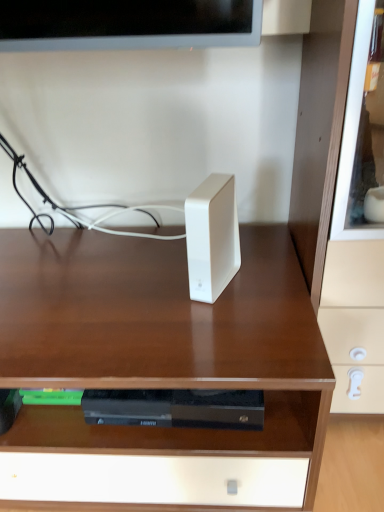
Question: Choose the correct answer: Is white matte ipod at center inside matte white drawer at right or outside it?

Choices:
 (A) inside
 (B) outside

Answer: (B)

Question: Looking at their shapes, would you say white matte ipod at center is wider or thinner than matte white drawer at right?

Choices:
 (A) wide
 (B) thin

Answer: (B)

Question: Which is farther from the matte white drawer at right?

Choices:
 (A) white glossy speaker at center
 (B) white matte ipod at center

Answer: (A)

Question: Which is farther from the matte white drawer at right?

Choices:
 (A) white glossy speaker at center
 (B) white matte ipod at center

Answer: (A)